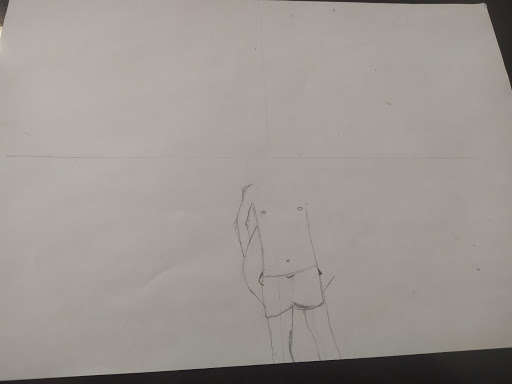
Find the location of a particular element. The width and height of the screenshot is (512, 384). black table / counter surface is located at coordinates (504, 17).